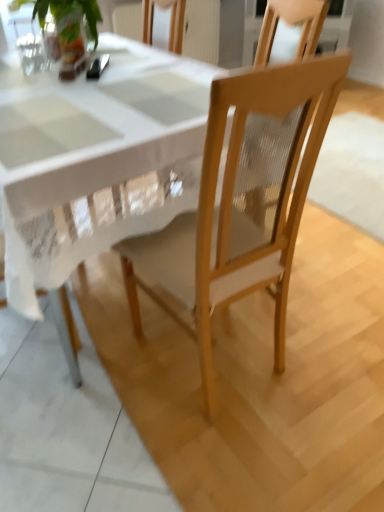
The image size is (384, 512). Identify the location of vacant area that lies between light wood chair at center and white glossy table at center. (200, 374).